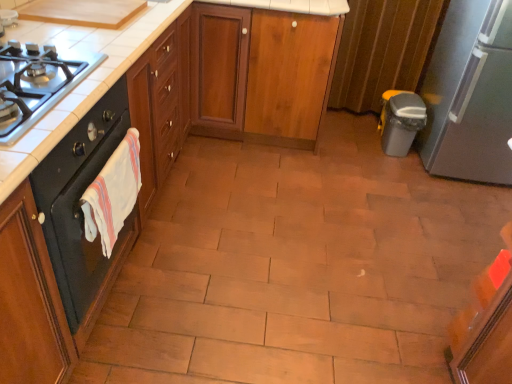
Question: Which direction should I rotate to look at wooden cabinet at center, which is counted as the second cabinetry, starting from the front?

Choices:
 (A) left
 (B) right

Answer: (B)

Question: Does black matte oven at left have a smaller size compared to satin silver refrigerator at right?

Choices:
 (A) yes
 (B) no

Answer: (A)

Question: Considering the relative sizes of black matte oven at left and satin silver refrigerator at right in the image provided, is black matte oven at left bigger than satin silver refrigerator at right?

Choices:
 (A) no
 (B) yes

Answer: (A)

Question: Can you confirm if black matte oven at left is positioned to the right of satin silver refrigerator at right?

Choices:
 (A) yes
 (B) no

Answer: (B)

Question: Is black matte oven at left oriented away from satin silver refrigerator at right?

Choices:
 (A) yes
 (B) no

Answer: (B)

Question: Considering the relative positions of black matte oven at left and satin silver refrigerator at right in the image provided, is black matte oven at left in front of satin silver refrigerator at right?

Choices:
 (A) no
 (B) yes

Answer: (B)

Question: Does black matte oven at left turn towards satin silver refrigerator at right?

Choices:
 (A) no
 (B) yes

Answer: (A)

Question: From a real-world perspective, is satin silver refrigerator at right beneath wooden cabinet at center, which is counted as the second cabinetry, starting from the front?

Choices:
 (A) no
 (B) yes

Answer: (A)

Question: Is wooden cabinet at center, which is counted as the second cabinetry, starting from the front, surrounded by satin silver refrigerator at right?

Choices:
 (A) yes
 (B) no

Answer: (B)

Question: Is satin silver refrigerator at right in contact with wooden cabinet at center, which is counted as the second cabinetry, starting from the front?

Choices:
 (A) yes
 (B) no

Answer: (B)

Question: Is satin silver refrigerator at right taller than wooden cabinet at center, which is counted as the second cabinetry, starting from the front?

Choices:
 (A) no
 (B) yes

Answer: (B)

Question: Does satin silver refrigerator at right have a smaller size compared to wooden cabinet at center, which is counted as the second cabinetry, starting from the front?

Choices:
 (A) no
 (B) yes

Answer: (A)

Question: Can you confirm if satin silver refrigerator at right is positioned to the right of wooden cabinet at center, which is counted as the second cabinetry, starting from the front?

Choices:
 (A) no
 (B) yes

Answer: (B)

Question: Is white cotton hand towel at left at the right side of black matte gas stove at left?

Choices:
 (A) no
 (B) yes

Answer: (B)